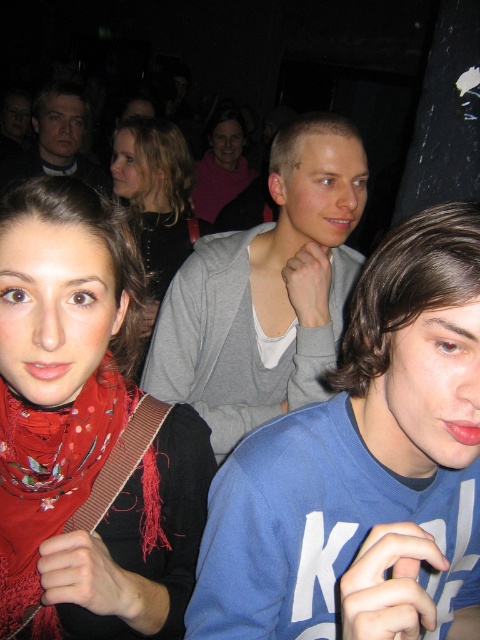
You are a photographer standing at the back of the room. You want to take a photo of the gray cotton sweater at center and the matte gray sweater at center. Can you fit both of them in your camera frame which has a maximum width of 1.5 meters?

The gray cotton sweater at center and the matte gray sweater at center are 1.51 meters apart. Since the distance between them exceeds the camera frame width of 1.5 meters, you cannot fit both in the frame.